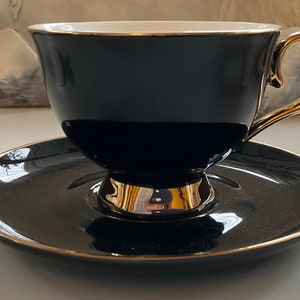
Locate an element on the screen. plate is located at coordinates (162, 237).